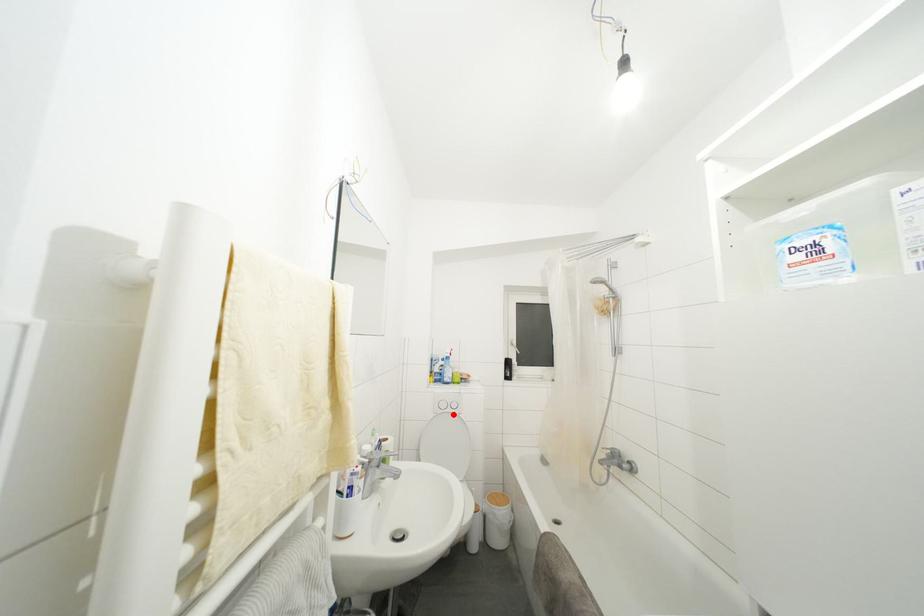
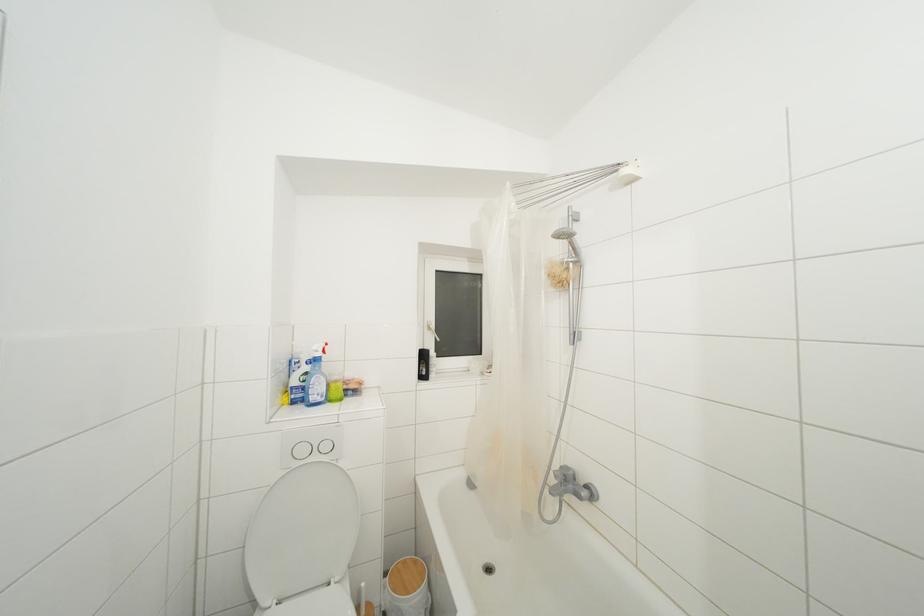
The point at the highlighted location is marked in the first image. Where is the corresponding point in the second image?

(320, 463)